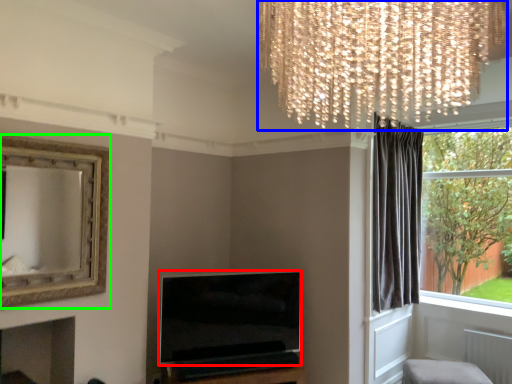
Question: Which object is positioned farthest from television (highlighted by a red box)? Select from lamp (highlighted by a blue box) and picture frame (highlighted by a green box).

Choices:
 (A) lamp
 (B) picture frame

Answer: (A)